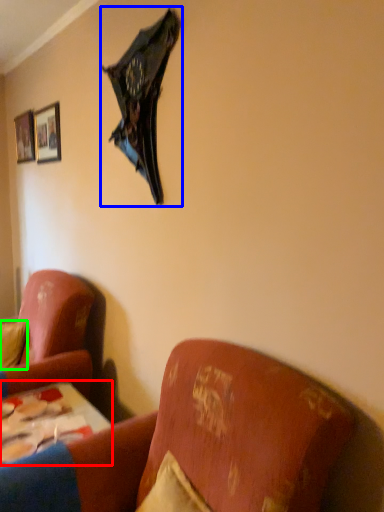
Question: Which is farther away from table (highlighted by a red box)? umbrella (highlighted by a blue box) or pillow (highlighted by a green box)?

Choices:
 (A) umbrella
 (B) pillow

Answer: (A)